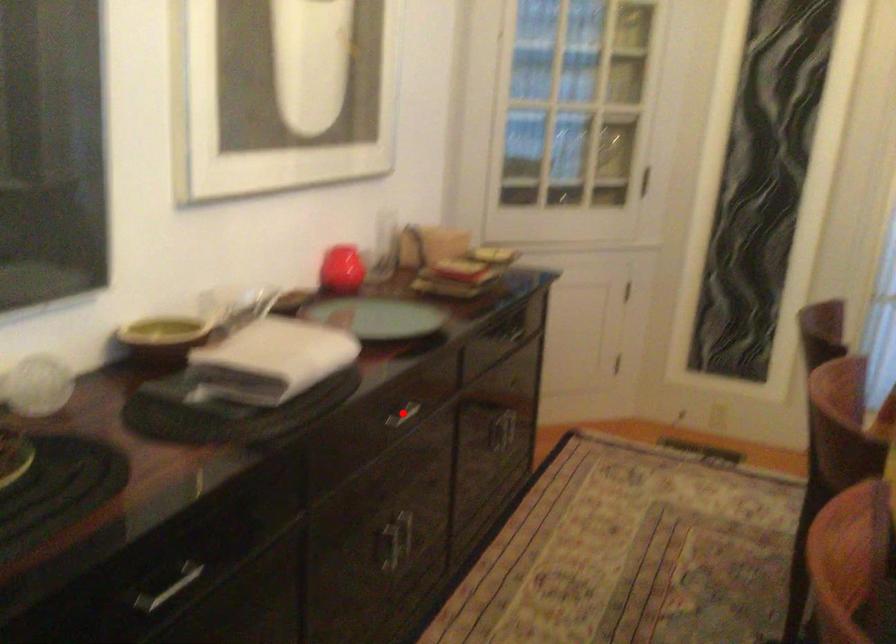
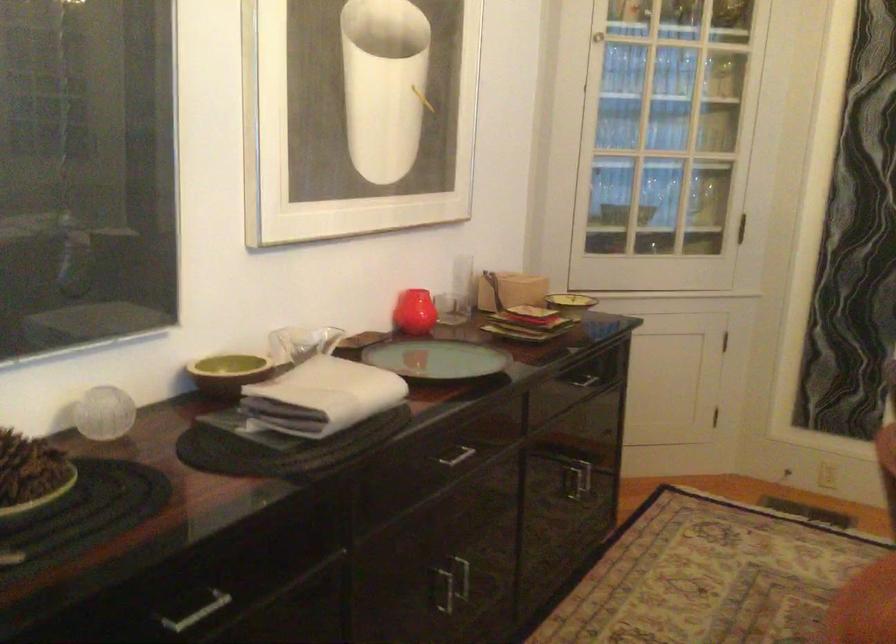
Find the pixel in the second image that matches the highlighted location in the first image.

(453, 455)